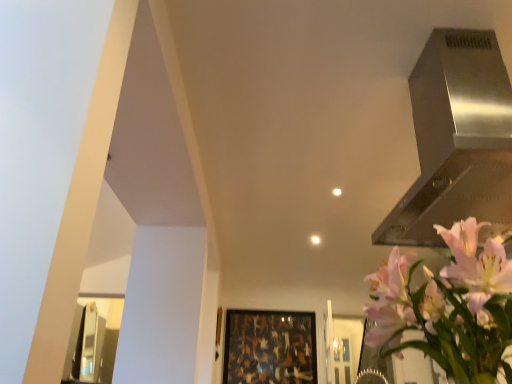
Question: Is stainless steel vent at upper right bigger than pink matte flower at upper right?

Choices:
 (A) no
 (B) yes

Answer: (B)

Question: Would you say stainless steel vent at upper right is outside pink matte flower at upper right?

Choices:
 (A) yes
 (B) no

Answer: (A)

Question: Is stainless steel vent at upper right to the right of pink matte flower at upper right from the viewer's perspective?

Choices:
 (A) no
 (B) yes

Answer: (B)

Question: Is stainless steel vent at upper right facing away from pink matte flower at upper right?

Choices:
 (A) no
 (B) yes

Answer: (A)

Question: Does stainless steel vent at upper right appear on the left side of pink matte flower at upper right?

Choices:
 (A) no
 (B) yes

Answer: (A)

Question: Considering the relative sizes of stainless steel vent at upper right and pink matte flower at upper right in the image provided, is stainless steel vent at upper right shorter than pink matte flower at upper right?

Choices:
 (A) no
 (B) yes

Answer: (A)

Question: Is wooden frame at center outside pink matte flower at upper right?

Choices:
 (A) yes
 (B) no

Answer: (A)

Question: From a real-world perspective, is wooden frame at center located higher than pink matte flower at upper right?

Choices:
 (A) no
 (B) yes

Answer: (B)

Question: From the image's perspective, is wooden frame at center beneath pink matte flower at upper right?

Choices:
 (A) yes
 (B) no

Answer: (A)

Question: Can you confirm if wooden frame at center is taller than pink matte flower at upper right?

Choices:
 (A) no
 (B) yes

Answer: (B)

Question: Is the position of wooden frame at center less distant than that of pink matte flower at upper right?

Choices:
 (A) no
 (B) yes

Answer: (A)

Question: Does wooden frame at center appear on the left side of pink matte flower at upper right?

Choices:
 (A) yes
 (B) no

Answer: (A)

Question: From a real-world perspective, is stainless steel vent at upper right over wooden frame at center?

Choices:
 (A) yes
 (B) no

Answer: (A)